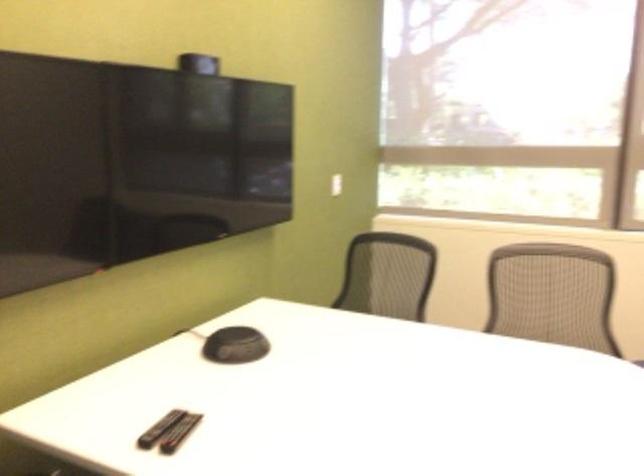
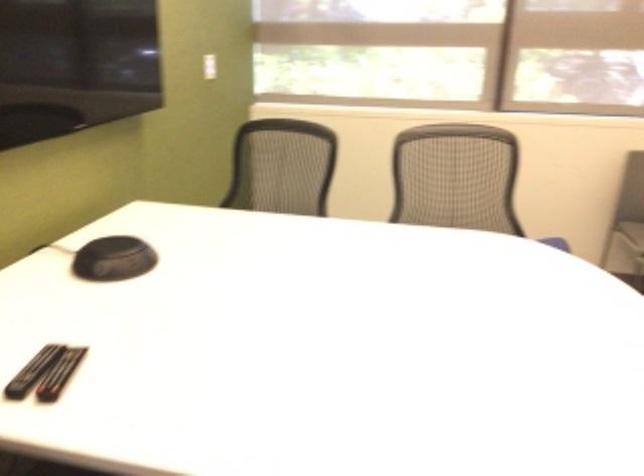
The point at (232,346) is marked in the first image. Where is the corresponding point in the second image?

(113, 259)